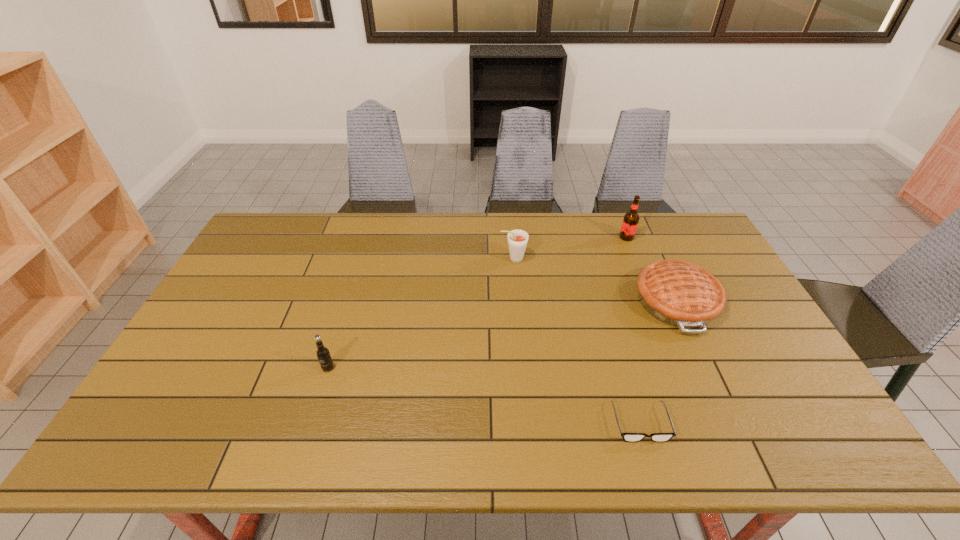
Image resolution: width=960 pixels, height=540 pixels. I want to click on the farthest root beer, so click(x=631, y=219).

You are a GUI agent. You are given a task and a screenshot of the screen. Output one action in this format:
    pyautogui.click(x=<x>, y=<y>)
    Task: Click on the farthest object
    
    Given the screenshot: What is the action you would take?
    pyautogui.click(x=631, y=219)

Where is `the second farthest root beer`? This screenshot has width=960, height=540. the second farthest root beer is located at coordinates (517, 239).

The width and height of the screenshot is (960, 540). Find the location of `the second root beer from left to right`. the second root beer from left to right is located at coordinates (517, 239).

The image size is (960, 540). Find the location of `the leftmost root beer`. the leftmost root beer is located at coordinates 323,354.

This screenshot has height=540, width=960. In order to click on the nearest root beer in this screenshot , I will do `click(323, 354)`.

I want to click on the third farthest object, so coord(675,292).

I want to click on the fourth tallest object, so [x=675, y=292].

I want to click on the third object from left to right, so click(x=628, y=437).

In order to click on the shortest object in this screenshot , I will do `click(628, 437)`.